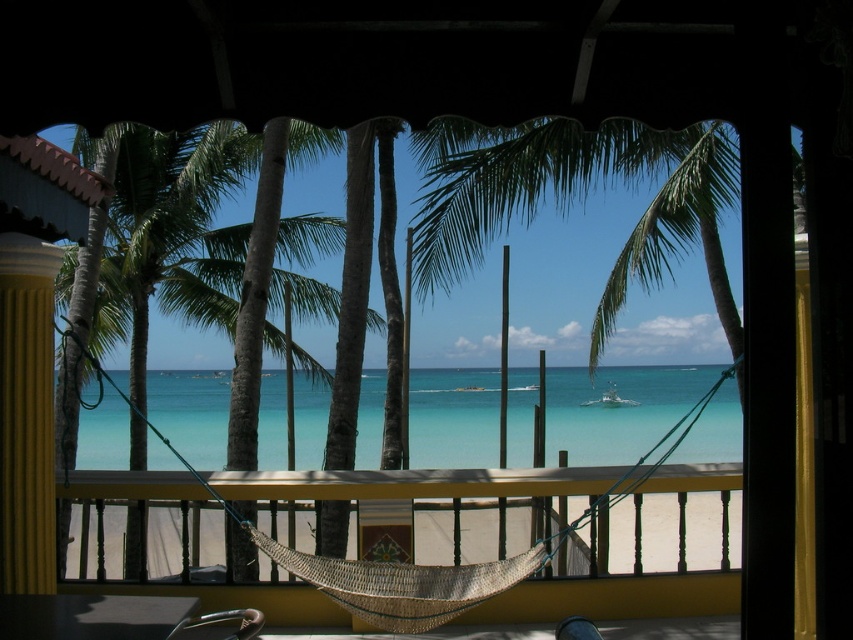
Image resolution: width=853 pixels, height=640 pixels. Describe the element at coordinates (618, 410) in the screenshot. I see `clear blue water at center` at that location.

Is clear blue water at center shorter than woven rope hammock at center?

No, clear blue water at center is not shorter than woven rope hammock at center.

Is point (711, 452) in front of point (103, 481)?

No, (711, 452) is behind (103, 481).

The image size is (853, 640). In order to click on clear blue water at center in this screenshot , I will do `click(618, 410)`.